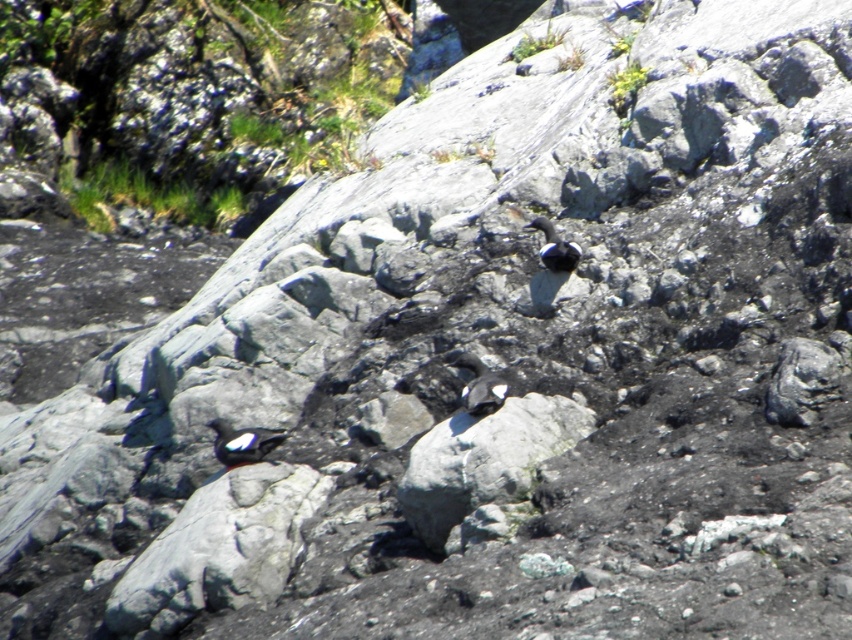
Does gray rough rock at lower left appear on the left side of white matte bird at center?

Correct, you'll find gray rough rock at lower left to the left of white matte bird at center.

Can you confirm if gray rough rock at lower left is positioned to the right of white matte bird at center?

In fact, gray rough rock at lower left is to the left of white matte bird at center.

Is point (263, 461) farther from viewer compared to point (268, 442)?

No, it is not.

The image size is (852, 640). I want to click on gray rough rock at lower left, so click(x=219, y=548).

Is point (263, 432) positioned before point (557, 243)?

No, it is behind (557, 243).

Is white matte bird at center to the left of black matte bird at upper center from the viewer's perspective?

Correct, you'll find white matte bird at center to the left of black matte bird at upper center.

In order to click on white matte bird at center in this screenshot , I will do `click(242, 442)`.

This screenshot has width=852, height=640. I want to click on white matte bird at center, so click(242, 442).

Is point (485, 397) positioned in front of point (551, 236)?

That is True.

Who is taller, black matte bird at center or black matte bird at upper center?

Standing taller between the two is black matte bird at upper center.

Based on the photo, who is more distant from viewer, (475,394) or (562,260)?

The point (562,260) is behind.

Identify the location of black matte bird at center. The image size is (852, 640). click(x=478, y=385).